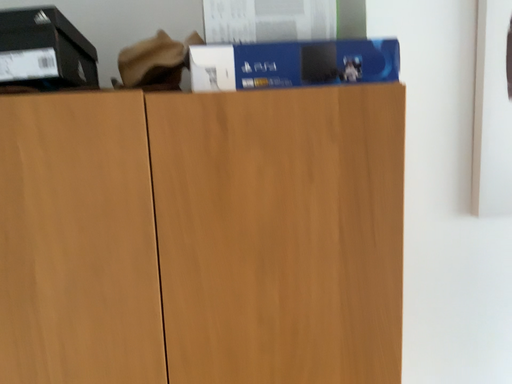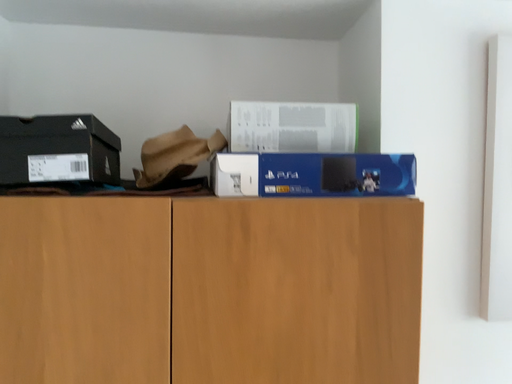
Question: How did the camera likely rotate when shooting the video?

Choices:
 (A) rotated upward
 (B) rotated downward

Answer: (A)